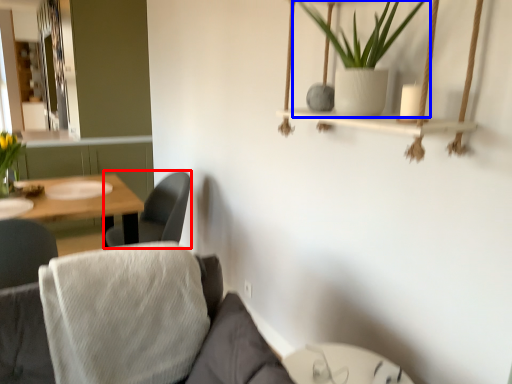
Question: Among these objects, which one is farthest to the camera, chair (highlighted by a red box) or houseplant (highlighted by a blue box)?

Choices:
 (A) chair
 (B) houseplant

Answer: (A)